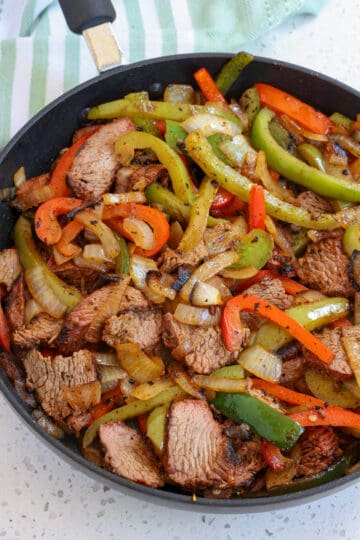
Image resolution: width=360 pixels, height=540 pixels. In order to click on cloth napkin in this screenshot , I will do `click(159, 29)`.